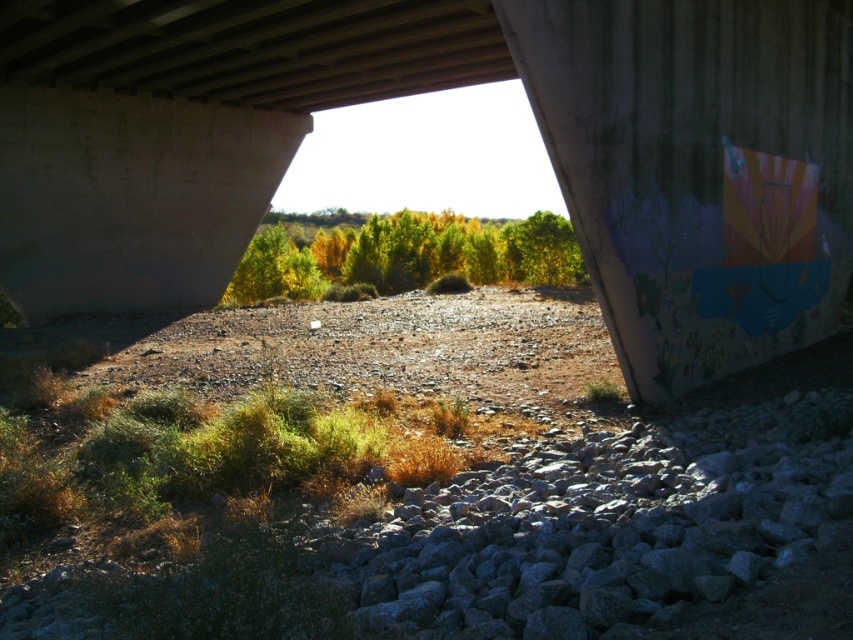
This screenshot has height=640, width=853. I want to click on concrete at center, so click(x=440, y=88).

Is concrete at center to the right of green matte trees at center from the viewer's perspective?

Yes, concrete at center is to the right of green matte trees at center.

Does point (611, 193) lie behind point (358, 240)?

No, (611, 193) is in front of (358, 240).

This screenshot has height=640, width=853. I want to click on concrete at center, so click(x=440, y=88).